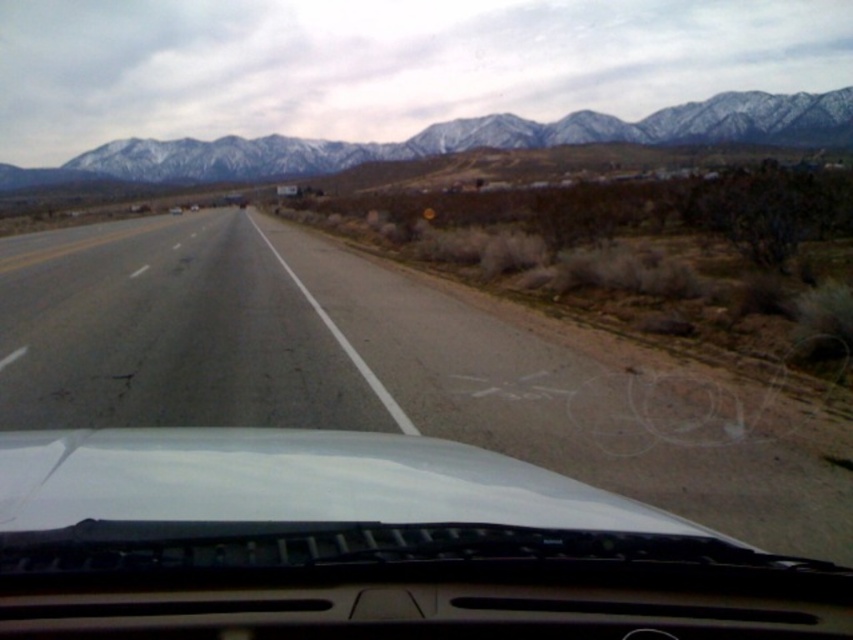
You are driving a car and need to check your surroundings. From your perspective inside the vehicle, which object is positioned to the right of the other between the white matte windshield at center and the asphalt road at center?

The white matte windshield at center is to the right of asphalt road at center according to the description.